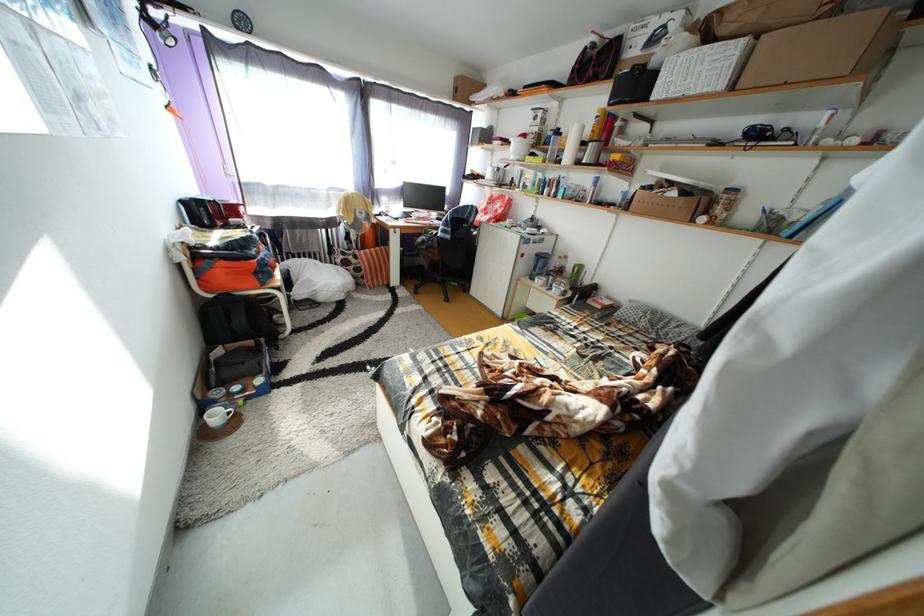
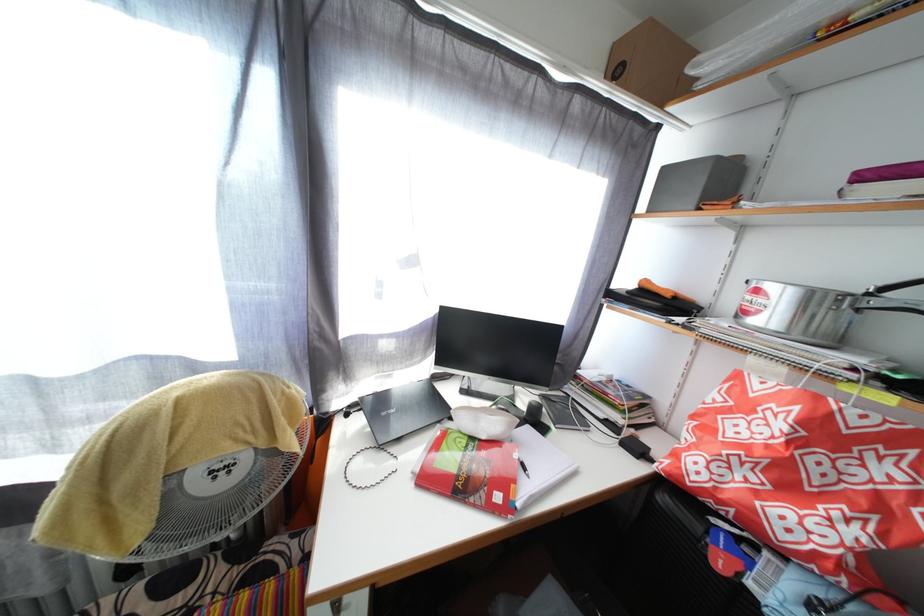
Question: What movement of the cameraman would produce the second image?

Choices:
 (A) Left
 (B) Right
 (C) Forward
 (D) Backward

Answer: (C)